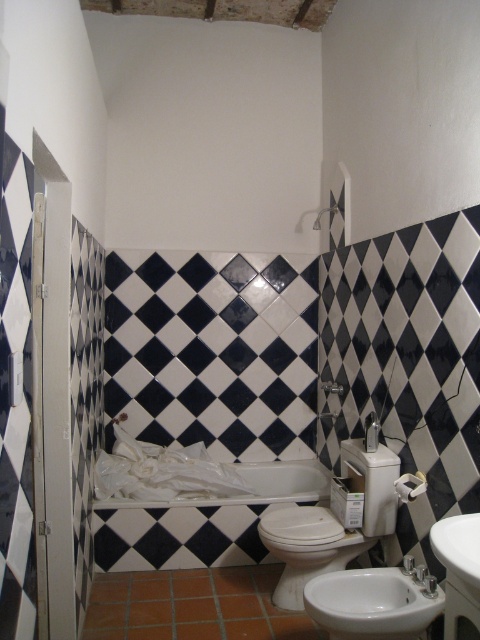
Question: Among these points, which one is farthest from the camera?

Choices:
 (A) (437, 556)
 (B) (320, 547)

Answer: (B)

Question: Which object is closer to the camera taking this photo?

Choices:
 (A) white glossy bidet at lower right
 (B) matte white shower at upper center
 (C) white glossy toilet bowl at lower center

Answer: (A)

Question: Is the position of white glossy bidet at lower right more distant than that of matte white shower at upper center?

Choices:
 (A) yes
 (B) no

Answer: (B)

Question: Which is farther from the white glossy bidet at lower right?

Choices:
 (A) white glossy toilet bowl at lower center
 (B) matte white shower at upper center
 (C) white glossy sink at lower right

Answer: (B)

Question: Does white glossy sink at lower right come in front of matte white shower at upper center?

Choices:
 (A) no
 (B) yes

Answer: (B)

Question: Does white glossy bidet at lower right have a lesser width compared to matte white shower at upper center?

Choices:
 (A) yes
 (B) no

Answer: (B)